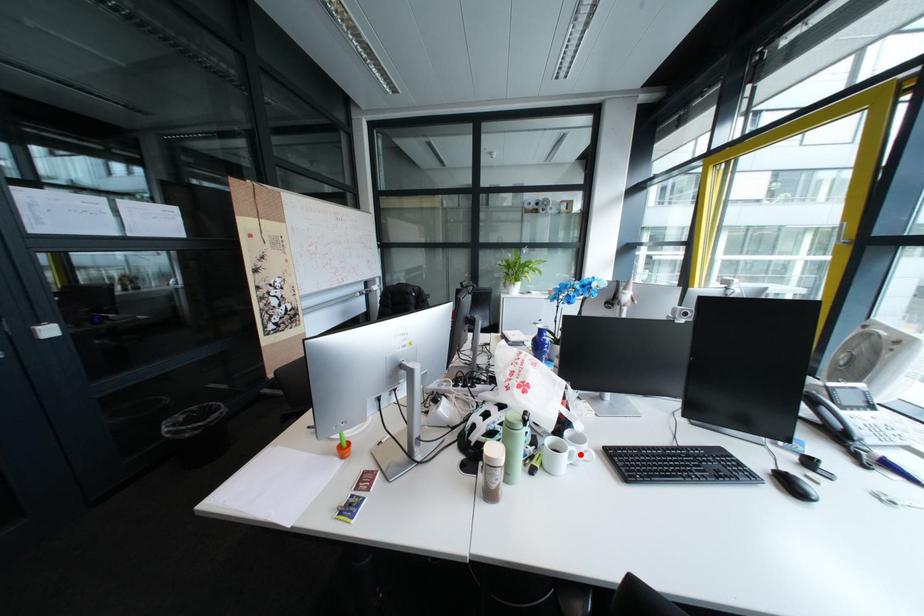
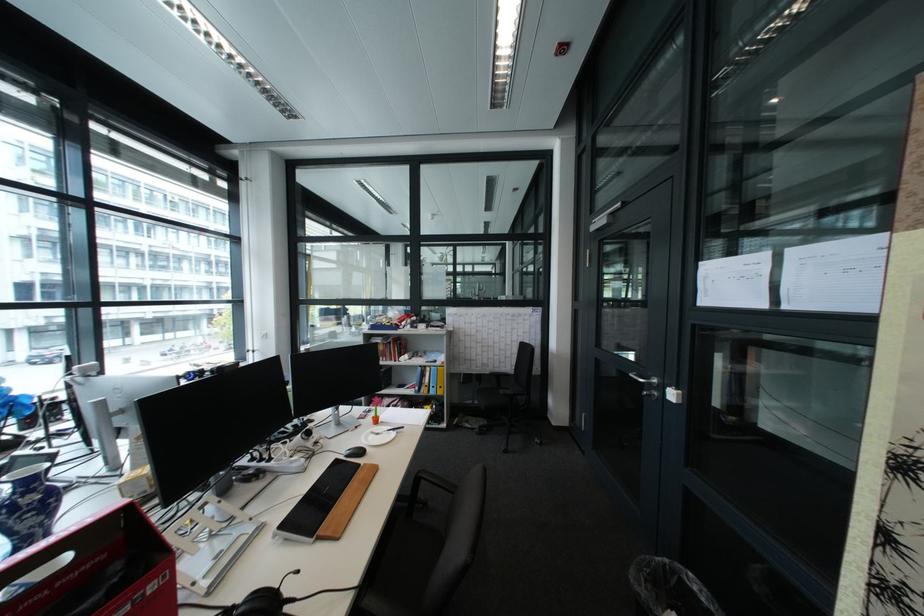
Question: I am providing you with two images of the same scene from different viewpoints. A red point is marked on the first image. Is the red point's position out of view in image 2?

Choices:
 (A) Yes
 (B) No

Answer: (A)